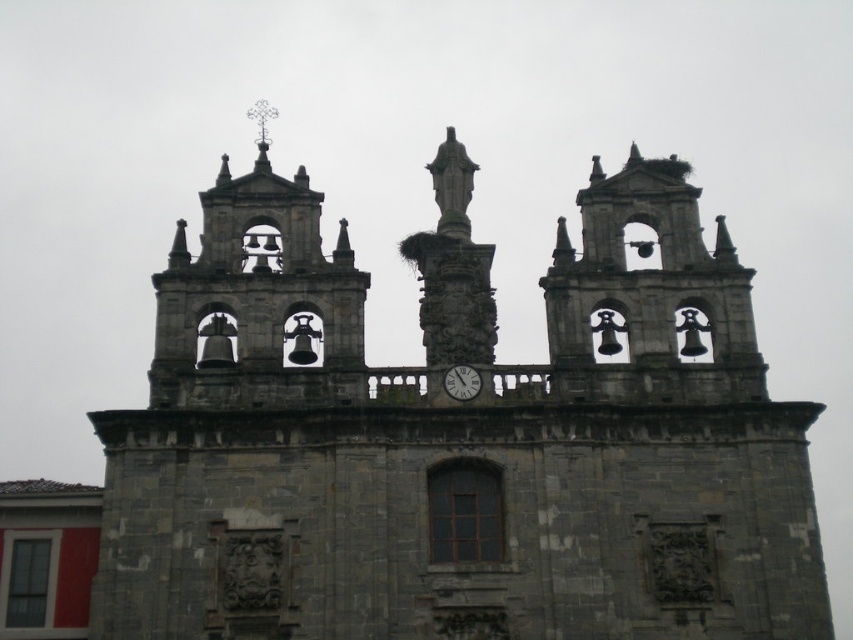
Question: Is the position of dark gray stone bell tower at center left less distant than that of white glossy clock at center?

Choices:
 (A) no
 (B) yes

Answer: (B)

Question: Can you confirm if gray stone church at center is wider than white glossy clock at center?

Choices:
 (A) yes
 (B) no

Answer: (A)

Question: Which of the following is the farthest from the observer?

Choices:
 (A) (492, 497)
 (B) (474, 394)
 (C) (196, 268)

Answer: (C)

Question: Estimate the real-world distances between objects in this image. Which object is closer to the white glossy clock at center?

Choices:
 (A) dark gray stone bell tower at upper center
 (B) gray stone church at center

Answer: (B)

Question: Which of the following is the farthest from the observer?

Choices:
 (A) (680, 634)
 (B) (460, 376)
 (C) (633, 148)
 (D) (260, 310)

Answer: (C)

Question: Does gray stone church at center have a lesser width compared to white glossy clock at center?

Choices:
 (A) no
 (B) yes

Answer: (A)